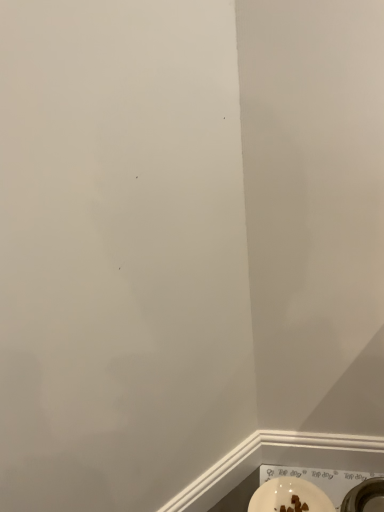
Where is `white glossy plate at lower right`? white glossy plate at lower right is located at coordinates (289, 496).

What do you see at coordinates (289, 496) in the screenshot? I see `white glossy plate at lower right` at bounding box center [289, 496].

This screenshot has height=512, width=384. I want to click on white glossy plate at lower right, so click(289, 496).